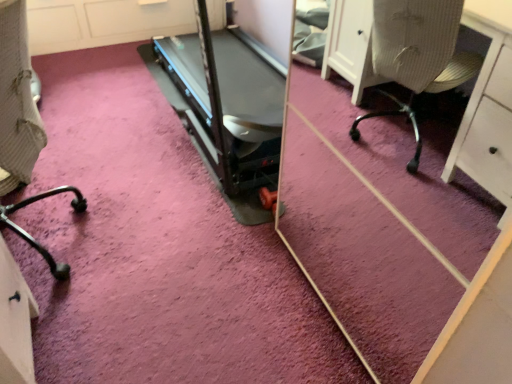
Measure the distance between black metal chair leg at lower left and camera.

The depth of black metal chair leg at lower left is 3.48 feet.

Find the location of `black metal chair leg at lower left`. black metal chair leg at lower left is located at coordinates (17, 101).

Describe the element at coordinates (17, 101) in the screenshot. I see `black metal chair leg at lower left` at that location.

Measure the distance between point (198, 87) and camera.

Point (198, 87) and camera are 2.22 meters apart.

What do you see at coordinates (226, 108) in the screenshot? This screenshot has width=512, height=384. I see `black plastic treadmill at center` at bounding box center [226, 108].

Find the location of a particular element. black plastic treadmill at center is located at coordinates (226, 108).

This screenshot has height=384, width=512. What are the coordinates of `black metal chair leg at lower left` in the screenshot? It's located at (17, 101).

Based on their positions, is black metal chair leg at lower left located to the left or right of black plastic treadmill at center?

In the image, black metal chair leg at lower left appears on the left side of black plastic treadmill at center.

Is black metal chair leg at lower left in front of black plastic treadmill at center?

Yes, the depth of black metal chair leg at lower left is less than that of black plastic treadmill at center.

Considering the positions of point (48, 252) and point (260, 214), is point (48, 252) closer or farther from the camera than point (260, 214)?

Point (48, 252) is positioned closer to the camera compared to point (260, 214).

From the image's perspective, is black metal chair leg at lower left above or below black plastic treadmill at center?

Based on their image positions, black metal chair leg at lower left is located beneath black plastic treadmill at center.

From a real-world perspective, who is located higher, black metal chair leg at lower left or black plastic treadmill at center?

From a 3D spatial view, black metal chair leg at lower left is above.

Can you confirm if black metal chair leg at lower left is wider than black plastic treadmill at center?

In fact, black metal chair leg at lower left might be narrower than black plastic treadmill at center.

Does black metal chair leg at lower left have a greater height compared to black plastic treadmill at center?

Yes.

Who is smaller, black metal chair leg at lower left or black plastic treadmill at center?

With smaller size is black metal chair leg at lower left.

Is black metal chair leg at lower left not within black plastic treadmill at center?

Indeed, black metal chair leg at lower left is completely outside black plastic treadmill at center.

Is black metal chair leg at lower left beside black plastic treadmill at center?

There is a gap between black metal chair leg at lower left and black plastic treadmill at center.

Does black metal chair leg at lower left turn towards black plastic treadmill at center?

No.

How many degrees apart are the facing directions of black metal chair leg at lower left and black plastic treadmill at center?

The angular difference between black metal chair leg at lower left and black plastic treadmill at center is 25.2 degrees.

Locate an element on the screen. furniture lying below the black plastic treadmill at center (from the image's perspective) is located at coordinates (17, 101).

Can you confirm if black plastic treadmill at center is positioned to the left of black metal chair leg at lower left?

No.

Is black plastic treadmill at center further to camera compared to black metal chair leg at lower left?

That is True.

Which is more distant, (253, 110) or (15, 141)?

The point (253, 110) is more distant.

From the image's perspective, is black plastic treadmill at center above or below black metal chair leg at lower left?

black plastic treadmill at center is situated higher than black metal chair leg at lower left in the image.

From a real-world perspective, is black plastic treadmill at center located beneath black metal chair leg at lower left?

Yes, from a real-world perspective, black plastic treadmill at center is below black metal chair leg at lower left.

Between black plastic treadmill at center and black metal chair leg at lower left, which one has smaller width?

black metal chair leg at lower left.

Does black plastic treadmill at center have a lesser height compared to black metal chair leg at lower left?

Yes.

Does black plastic treadmill at center have a smaller size compared to black metal chair leg at lower left?

Actually, black plastic treadmill at center might be larger than black metal chair leg at lower left.

Would you say black plastic treadmill at center is inside or outside black metal chair leg at lower left?

black plastic treadmill at center is located beyond the bounds of black metal chair leg at lower left.

Are black plastic treadmill at center and black metal chair leg at lower left located far from each other?

That's not correct — black plastic treadmill at center is a little close to black metal chair leg at lower left.

Does black plastic treadmill at center turn towards black metal chair leg at lower left?

Yes, black plastic treadmill at center is turned towards black metal chair leg at lower left.

Measure the distance between black plastic treadmill at center and black metal chair leg at lower left.

black plastic treadmill at center and black metal chair leg at lower left are 35.28 inches apart from each other.

I want to click on furniture that appears on the left of black plastic treadmill at center, so click(17, 101).

The height and width of the screenshot is (384, 512). I want to click on treadmill that appears above the black metal chair leg at lower left (from the image's perspective), so click(x=226, y=108).

Where is `furniture positioned vertically above the black plastic treadmill at center (from a real-world perspective)`? The image size is (512, 384). furniture positioned vertically above the black plastic treadmill at center (from a real-world perspective) is located at coordinates (17, 101).